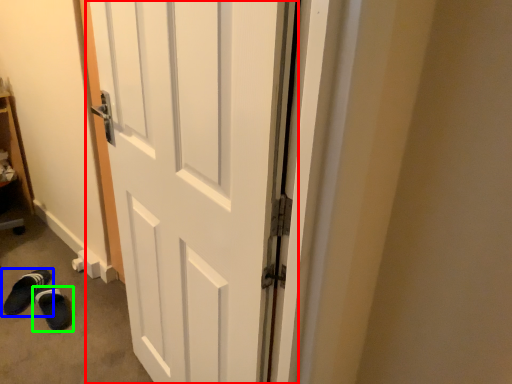
Question: Which object is the farthest from door (highlighted by a red box)? Choose among these: footwear (highlighted by a blue box) or footwear (highlighted by a green box).

Choices:
 (A) footwear
 (B) footwear

Answer: (A)